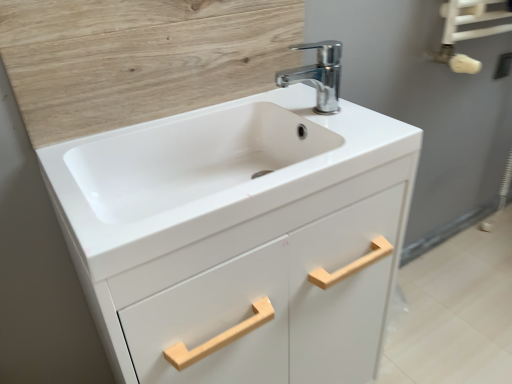
Question: Can you confirm if chrome metallic faucet at upper center is shorter than wooden panel at upper left?

Choices:
 (A) no
 (B) yes

Answer: (B)

Question: Is chrome metallic faucet at upper center located outside wooden panel at upper left?

Choices:
 (A) no
 (B) yes

Answer: (B)

Question: Is chrome metallic faucet at upper center turned away from wooden panel at upper left?

Choices:
 (A) yes
 (B) no

Answer: (B)

Question: Is chrome metallic faucet at upper center taller than wooden panel at upper left?

Choices:
 (A) yes
 (B) no

Answer: (B)

Question: From the image's perspective, is chrome metallic faucet at upper center on top of wooden panel at upper left?

Choices:
 (A) yes
 (B) no

Answer: (B)

Question: Could you tell me if chrome metallic faucet at upper center is facing wooden panel at upper left?

Choices:
 (A) yes
 (B) no

Answer: (B)

Question: Does chrome metallic faucet at upper center lie behind white matte cabinet at center?

Choices:
 (A) yes
 (B) no

Answer: (A)

Question: From the image's perspective, is chrome metallic faucet at upper center located beneath white matte cabinet at center?

Choices:
 (A) yes
 (B) no

Answer: (B)

Question: Would you consider chrome metallic faucet at upper center to be distant from white matte cabinet at center?

Choices:
 (A) yes
 (B) no

Answer: (B)

Question: Is chrome metallic faucet at upper center at the left side of white matte cabinet at center?

Choices:
 (A) no
 (B) yes

Answer: (A)

Question: From the image's perspective, does chrome metallic faucet at upper center appear higher than white matte cabinet at center?

Choices:
 (A) yes
 (B) no

Answer: (A)

Question: Considering the relative sizes of chrome metallic faucet at upper center and white matte cabinet at center in the image provided, is chrome metallic faucet at upper center smaller than white matte cabinet at center?

Choices:
 (A) yes
 (B) no

Answer: (A)

Question: Is white matte cabinet at center at the back of white glossy towel rack at upper right?

Choices:
 (A) no
 (B) yes

Answer: (A)